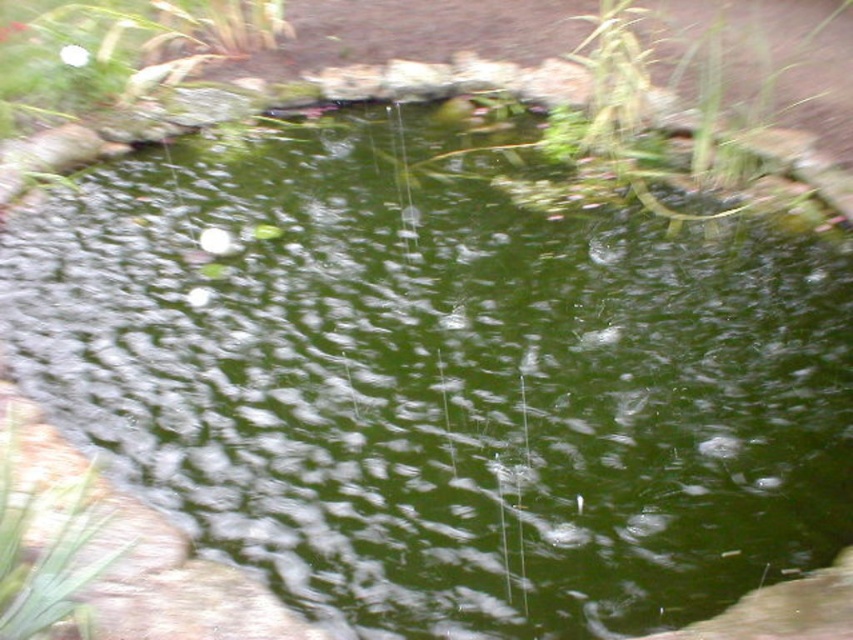
Question: Which point is closer to the camera?

Choices:
 (A) white matte rock at upper left
 (B) green leafy plant at upper center
 (C) green leafy plant at lower left

Answer: (C)

Question: Is white matte rock at upper left thinner than green leafy plant at lower left?

Choices:
 (A) no
 (B) yes

Answer: (A)

Question: Is green leafy plant at lower left to the left of green leafy plant at upper center from the viewer's perspective?

Choices:
 (A) no
 (B) yes

Answer: (B)

Question: Considering the real-world distances, which object is closest to the green leafy plant at lower left?

Choices:
 (A) green leafy plant at upper center
 (B) white matte rock at upper left

Answer: (B)

Question: Is white matte rock at upper left bigger than green leafy plant at lower left?

Choices:
 (A) no
 (B) yes

Answer: (B)

Question: Among these points, which one is nearest to the camera?

Choices:
 (A) (16, 410)
 (B) (15, 28)

Answer: (A)